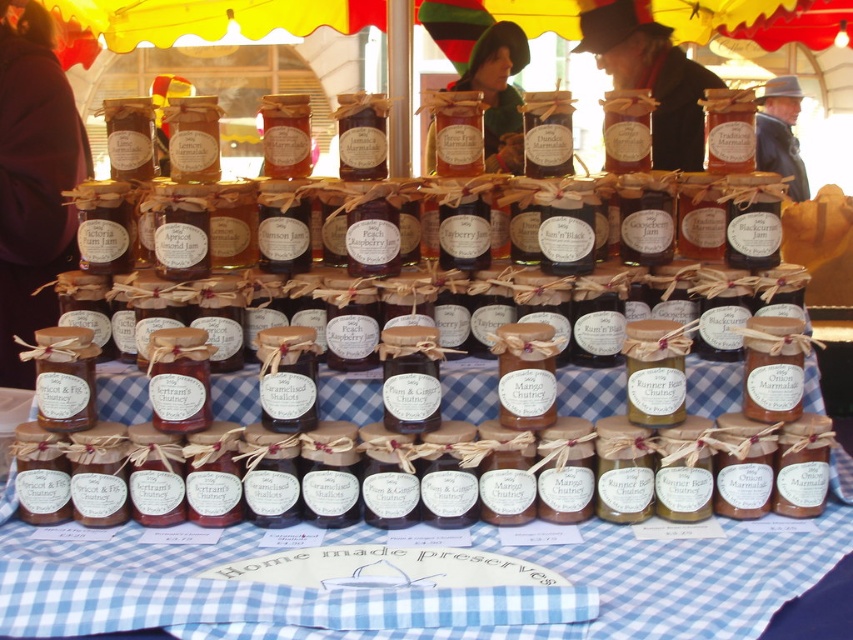
Question: Which is nearer to the blue checkered fabric at center?

Choices:
 (A) dark brown wool coat at left
 (B) green felt hat at upper center

Answer: (A)

Question: Can you confirm if blue checkered fabric at center is positioned above dark brown wool coat at left?

Choices:
 (A) no
 (B) yes

Answer: (A)

Question: Observing the image, what is the correct spatial positioning of blue checkered fabric at center in reference to green felt hat at upper center?

Choices:
 (A) above
 (B) below

Answer: (B)

Question: Which point is farther from the camera taking this photo?

Choices:
 (A) (38, 22)
 (B) (0, 616)
 (C) (486, 131)

Answer: (C)

Question: In this image, where is blue checkered fabric at center located relative to green felt hat at upper center?

Choices:
 (A) left
 (B) right

Answer: (A)

Question: Which of these objects is positioned farthest from the dark brown wool coat at left?

Choices:
 (A) blue checkered fabric at center
 (B) green felt hat at upper center

Answer: (B)